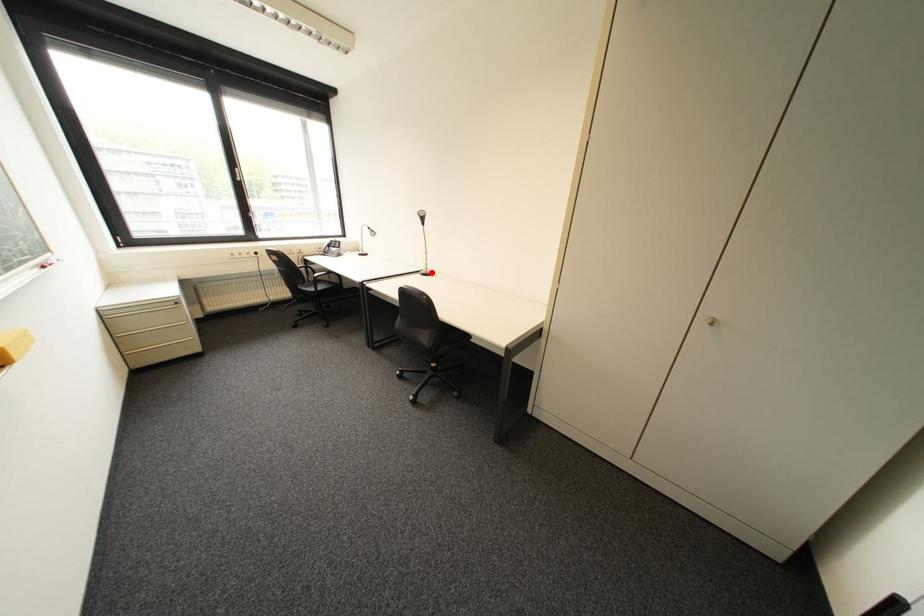
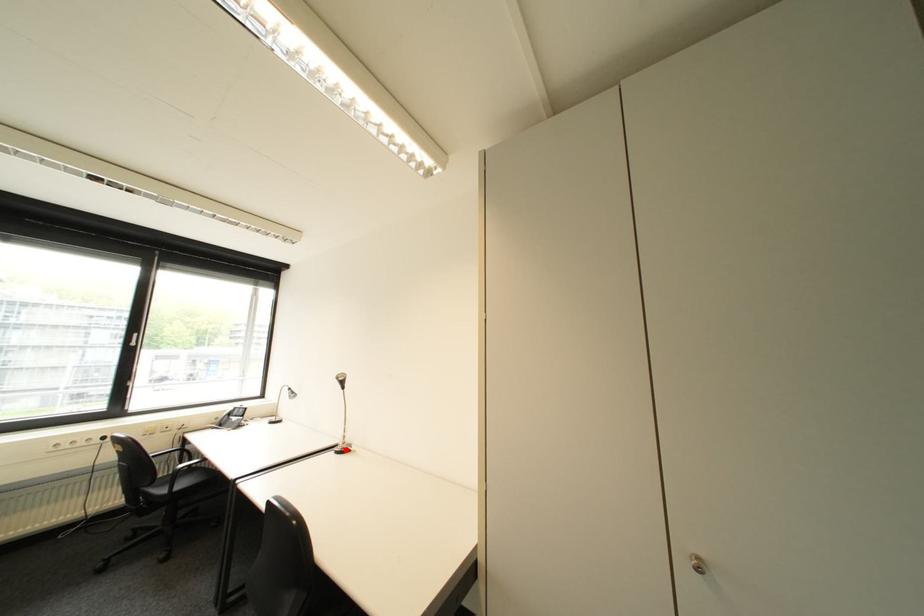
I am providing you with two images of the same scene from different viewpoints. A red point is marked on the first image and another point is marked on the second image. Is the red point in image1 aligned with the point shown in image2?

Yes